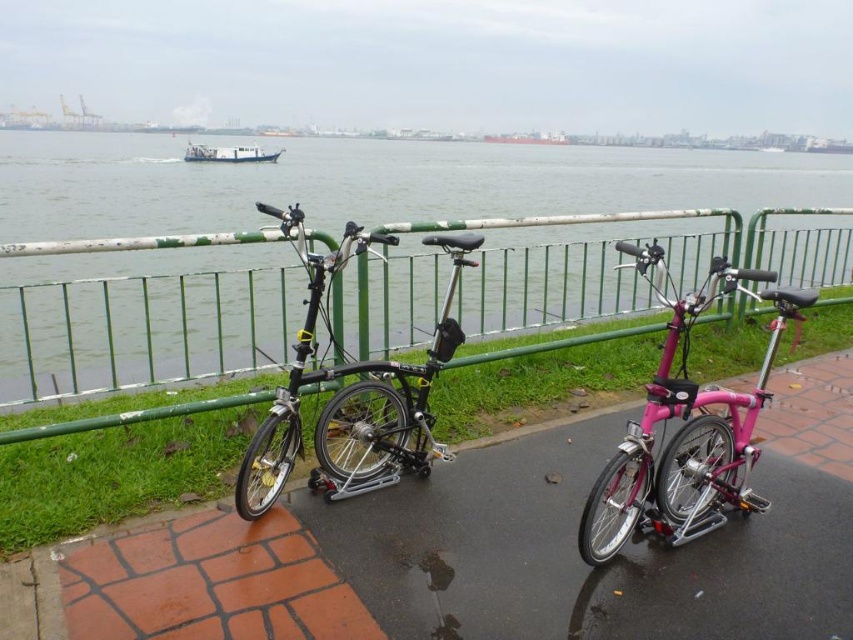
You are a delivery person with a cart that is 30 inches wide. You need to pass between the green metal fence at center and the black matte folding bike at center. Can your cart fit through the space between them?

The distance between the green metal fence at center and the black matte folding bike at center is 32.74 inches. Since your cart is 30 inches wide, it can fit through the space as there is enough width available.

You are standing at the point marked by the coordinates point [142,330]. Looking around, you see two bicycles placed on a paved pathway. Which direction should you walk to reach the green metal railing that the bicycles are leaning against?

The point [142,330] indicates the green metal fence at center. Since the bicycles are leaning against the green metal railing, you should walk towards the bicycles located on the paved pathway to reach the railing.